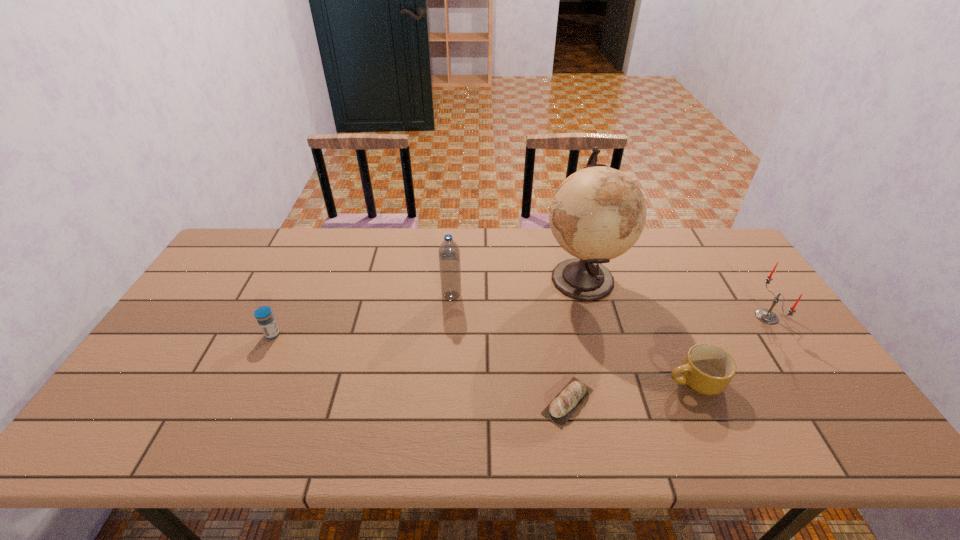
At what (x,y) coordinates should I click in order to perform the action: click on vacant region located on the front-facing side of the tallest object. Please return your answer as a coordinate pair (x, y). The height and width of the screenshot is (540, 960). Looking at the image, I should click on (475, 278).

The height and width of the screenshot is (540, 960). I want to click on blank space located 0.120m on the left of the water bottle, so click(402, 295).

Identify the location of vacant space located 0.380m on the front-facing side of the fourth shortest object. The image size is (960, 540). (626, 316).

At what (x,y) coordinates should I click in order to perform the action: click on free location located on the front-facing side of the fourth shortest object. Please return your answer as a coordinate pair (x, y). The height and width of the screenshot is (540, 960). Looking at the image, I should click on (687, 316).

Identify the location of vacant space located on the front-facing side of the fourth shortest object. (677, 316).

Where is `free space located 0.050m on the right of the leftmost object`? free space located 0.050m on the right of the leftmost object is located at coordinates (299, 334).

At what (x,y) coordinates should I click in order to perform the action: click on vacant region located 0.250m on the side with the handle of the second object from right to left. Please return your answer as a coordinate pair (x, y). The height and width of the screenshot is (540, 960). Looking at the image, I should click on (565, 382).

The height and width of the screenshot is (540, 960). What are the coordinates of `blank space located 0.350m on the side with the handle of the second object from right to left` in the screenshot? It's located at (526, 382).

At what (x,y) coordinates should I click in order to perform the action: click on free space located 0.290m on the side with the handle of the second object from right to left. Please return your answer as a coordinate pair (x, y). Looking at the image, I should click on (550, 382).

Image resolution: width=960 pixels, height=540 pixels. Find the location of `free location located on the back of the shortest object`. free location located on the back of the shortest object is located at coordinates (555, 328).